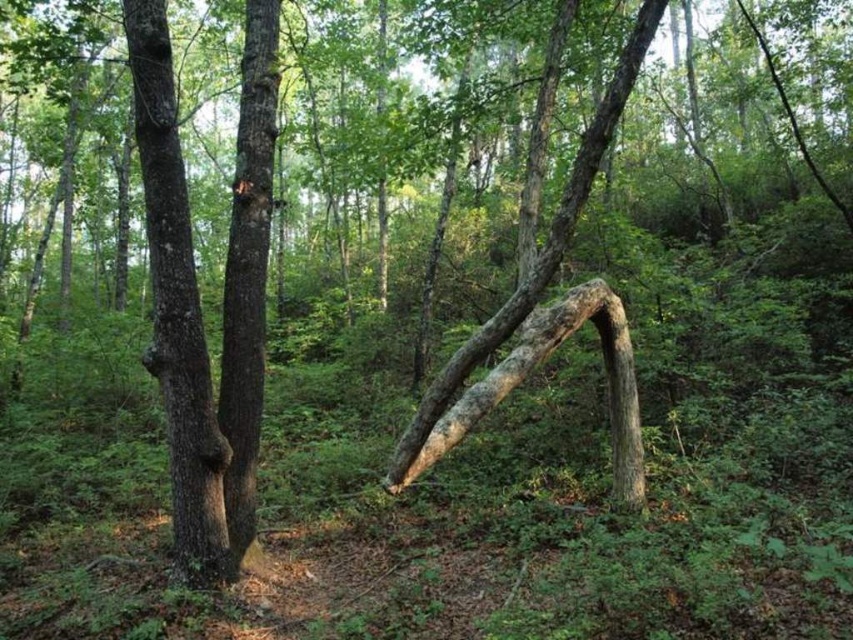
You are a park ranger assessing tree health. You notice the brown rough bark tree trunk at left and the smooth brown tree trunk at center. Which tree might have a larger diameter?

The brown rough bark tree trunk at left might be wider than the smooth brown tree trunk at center, so it could have a larger diameter.

You are standing in the forest and see the curved tree trunk forming an arch. There is a point marked at coordinates (177,310). According to the scene, what does this point represent?

The point at coordinates (177,310) corresponds to the brown rough bark tree trunk at left.

From the picture: You are a hiker trying to navigate through the forest. You see the brown rough bark tree trunk at left and the smooth brown tree trunk at center. Which tree trunk is positioned lower in the scene?

Answer: The brown rough bark tree trunk at left is located below the smooth brown tree trunk at center, so it is positioned lower in the scene.